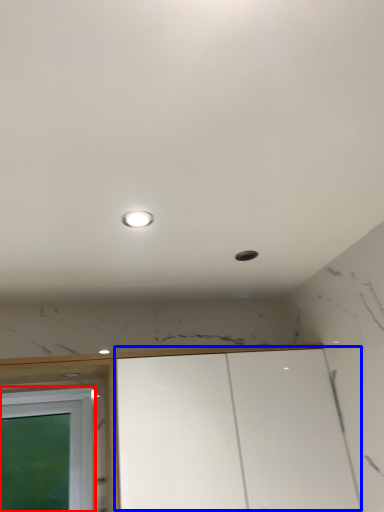
Question: Which point is closer to the camera, window (highlighted by a red box) or cabinetry (highlighted by a blue box)?

Choices:
 (A) window
 (B) cabinetry

Answer: (B)